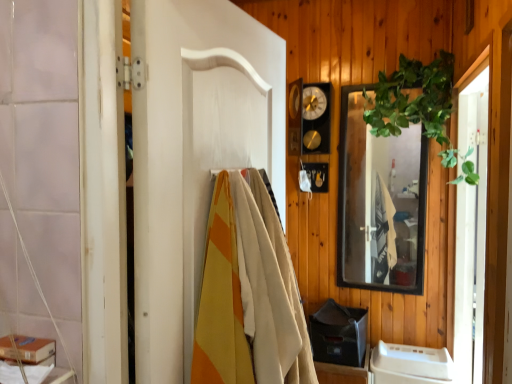
Question: Is white plastic container at lower right spatially inside black glass mirror at upper right, or outside of it?

Choices:
 (A) outside
 (B) inside

Answer: (A)

Question: Looking at the image, does white plastic container at lower right seem bigger or smaller compared to black glass mirror at upper right?

Choices:
 (A) big
 (B) small

Answer: (A)

Question: Estimate the real-world distances between objects in this image. Which object is farther from the transparent glass screen door at right?

Choices:
 (A) white painted wood door at center
 (B) green leafy plant at upper right
 (C) black glass mirror at upper right
 (D) white plastic container at lower right

Answer: (A)

Question: Estimate the real-world distances between objects in this image. Which object is farther from the white painted wood door at center?

Choices:
 (A) green leafy plant at upper right
 (B) transparent glass screen door at right
 (C) white plastic container at lower right
 (D) black glass mirror at upper right

Answer: (C)